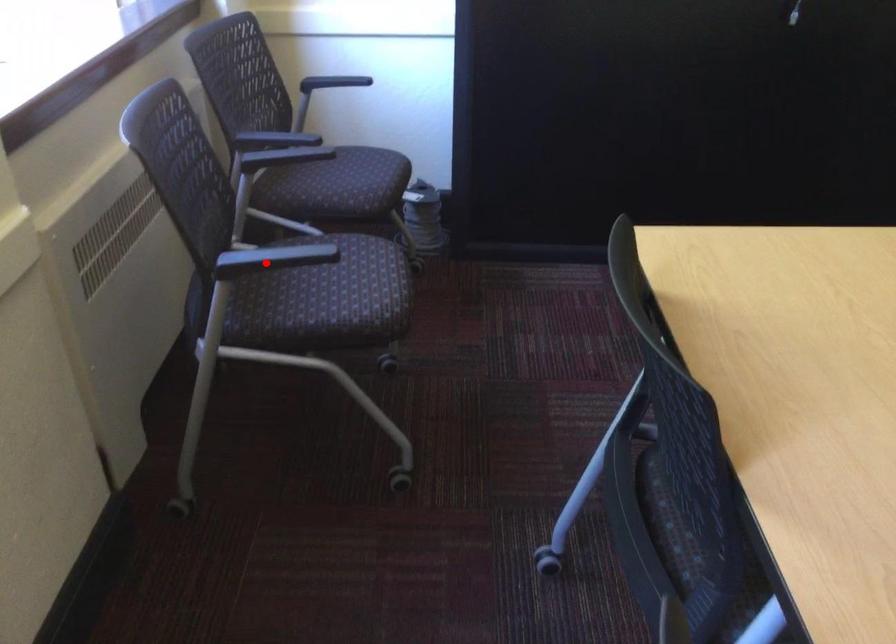
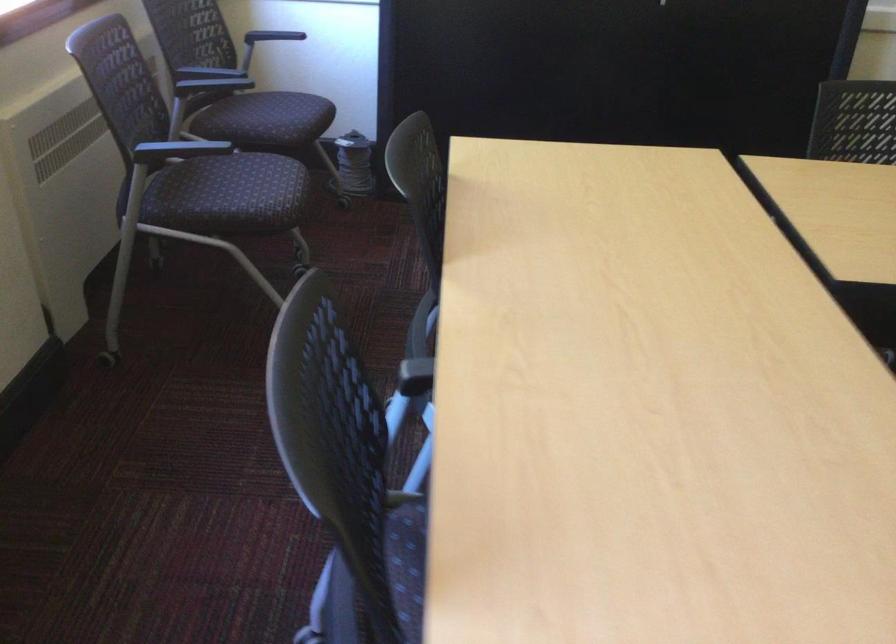
Question: I am providing you with two images of the same scene from different viewpoints. In image1, a red point is highlighted. Considering the same 3D point in image2, which of the following is correct?

Choices:
 (A) It is closer
 (B) It is farther

Answer: (B)